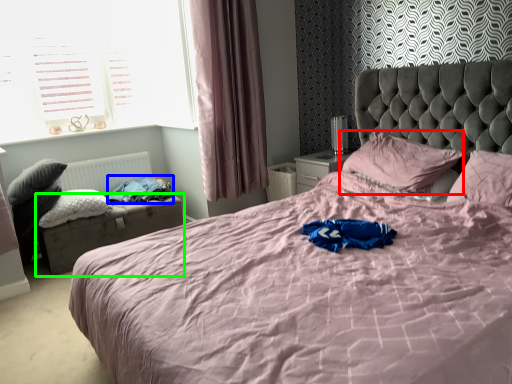
Question: Based on their relative distances, which object is farther from pillow (highlighted by a red box)? Choose from clothing (highlighted by a blue box) and bed frame (highlighted by a green box).

Choices:
 (A) clothing
 (B) bed frame

Answer: (B)